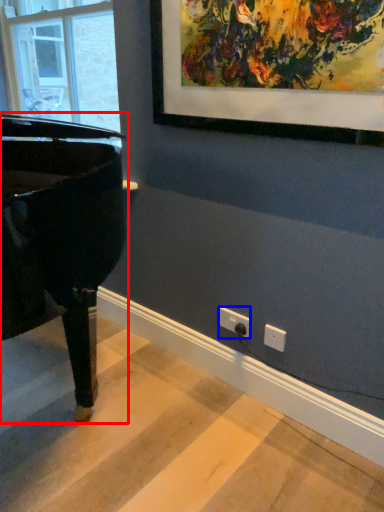
Question: Which of the following is the farthest to the observer, piano (highlighted by a red box) or electric outlet (highlighted by a blue box)?

Choices:
 (A) piano
 (B) electric outlet

Answer: (B)